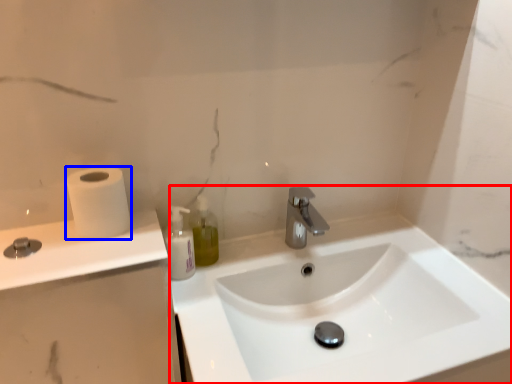
Question: Which point is closer to the camera, sink (highlighted by a red box) or toilet paper (highlighted by a blue box)?

Choices:
 (A) sink
 (B) toilet paper

Answer: (A)